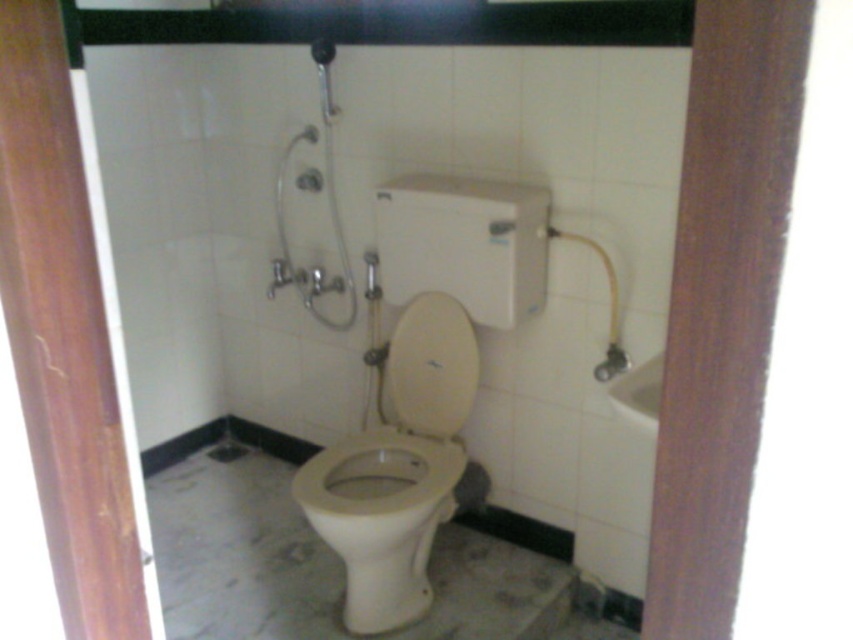
Question: Based on their relative distances, which object is nearer to the white glossy toilet at center?

Choices:
 (A) white glossy toilet seat at center
 (B) metallic silver shower at upper center

Answer: (A)

Question: Does white glossy toilet seat at center lie in front of metallic silver shower at upper center?

Choices:
 (A) no
 (B) yes

Answer: (B)

Question: Can you confirm if white glossy toilet seat at center is bigger than metallic silver shower at upper center?

Choices:
 (A) yes
 (B) no

Answer: (A)

Question: Which object is the farthest from the white glossy toilet seat at center?

Choices:
 (A) white glossy toilet at center
 (B) metallic silver shower at upper center

Answer: (B)

Question: Does white glossy toilet at center appear on the left side of metallic silver shower at upper center?

Choices:
 (A) yes
 (B) no

Answer: (B)

Question: Among these objects, which one is farthest from the camera?

Choices:
 (A) white glossy toilet seat at center
 (B) white glossy toilet bowl at center

Answer: (A)